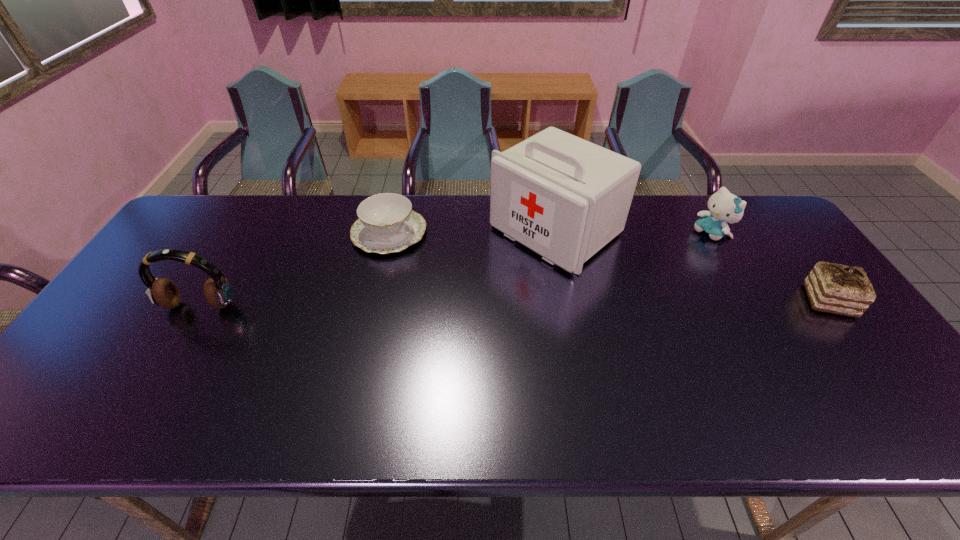
At what (x,y) coordinates should I click in order to perform the action: click on vacant point located 0.330m on the front-facing side of the first-aid kit. Please return your answer as a coordinate pair (x, y). This screenshot has width=960, height=540. Looking at the image, I should click on (426, 325).

At what (x,y) coordinates should I click in order to perform the action: click on free location located 0.100m on the front-facing side of the first-aid kit. Please return your answer as a coordinate pair (x, y). The width and height of the screenshot is (960, 540). Looking at the image, I should click on (488, 280).

At what (x,y) coordinates should I click in order to perform the action: click on vacant point located on the front-facing side of the first-aid kit. Please return your answer as a coordinate pair (x, y). The width and height of the screenshot is (960, 540). Looking at the image, I should click on (438, 317).

Image resolution: width=960 pixels, height=540 pixels. Identify the location of vacant area situated 0.370m on the face of the kitten. (617, 288).

Find the location of a particular element. This screenshot has height=540, width=960. vacant point located on the face of the kitten is located at coordinates (651, 268).

The width and height of the screenshot is (960, 540). I want to click on free space located on the face of the kitten, so click(649, 270).

I want to click on free space located 0.110m on the handle side of the fourth object from right to left, so click(x=442, y=265).

Locate an element on the screen. This screenshot has height=540, width=960. vacant area situated 0.130m on the handle side of the fourth object from right to left is located at coordinates (446, 268).

Where is `vacant region located on the handle side of the fourth object from right to left`? vacant region located on the handle side of the fourth object from right to left is located at coordinates (432, 259).

You are a GUI agent. You are given a task and a screenshot of the screen. Output one action in this format:
    pyautogui.click(x=<x>, y=<y>)
    Task: Click on the first-aid kit that is at the far edge
    This screenshot has width=960, height=540.
    Given the screenshot: What is the action you would take?
    565,198